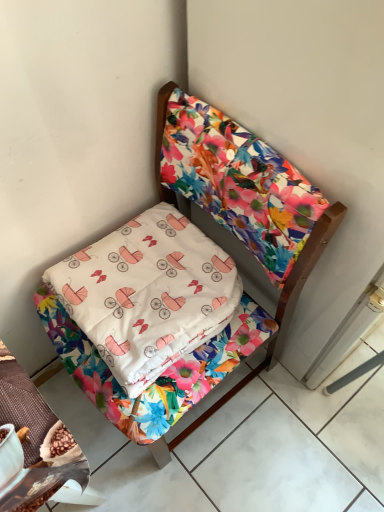
In order to click on empty space that is ontop of white cotton pillow at center (from a real-world perspective) in this screenshot , I will do `click(141, 272)`.